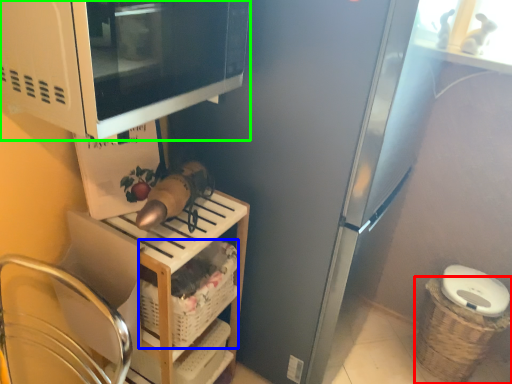
Question: Based on their relative distances, which object is nearer to basket (highlighted by a red box)? Choose from basket (highlighted by a blue box) and microwave oven (highlighted by a green box).

Choices:
 (A) basket
 (B) microwave oven

Answer: (A)